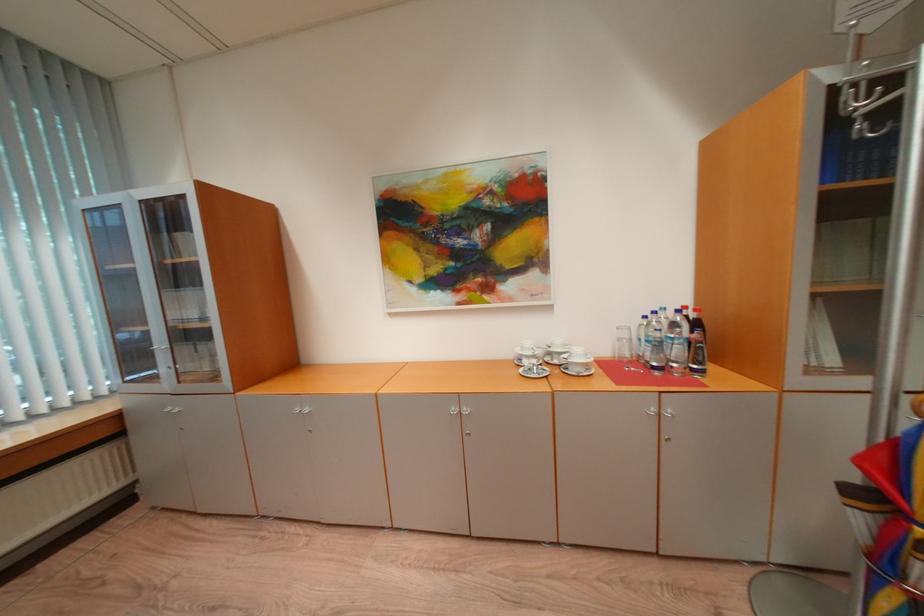
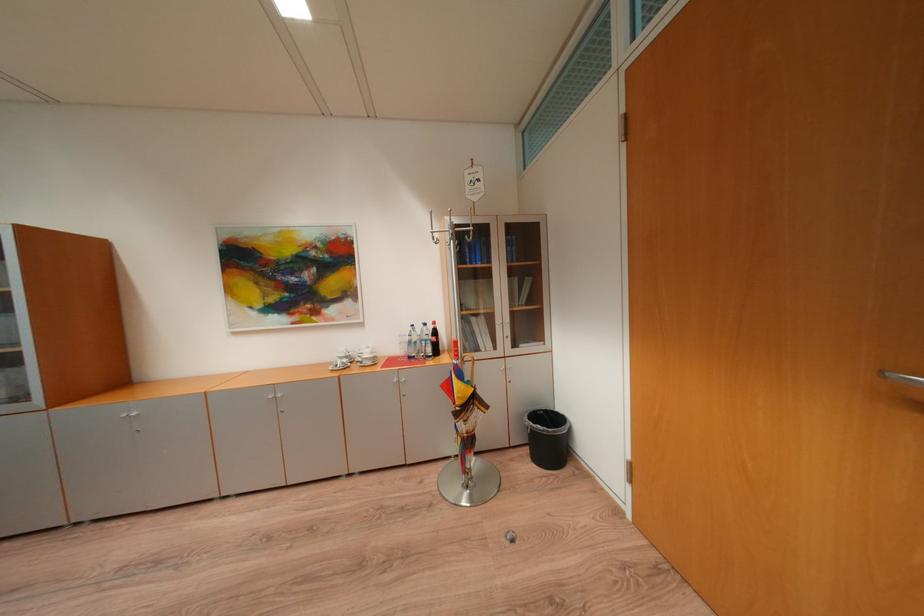
Locate, in the second image, the point that corresponds to pixel 687 313 in the first image.

(434, 326)